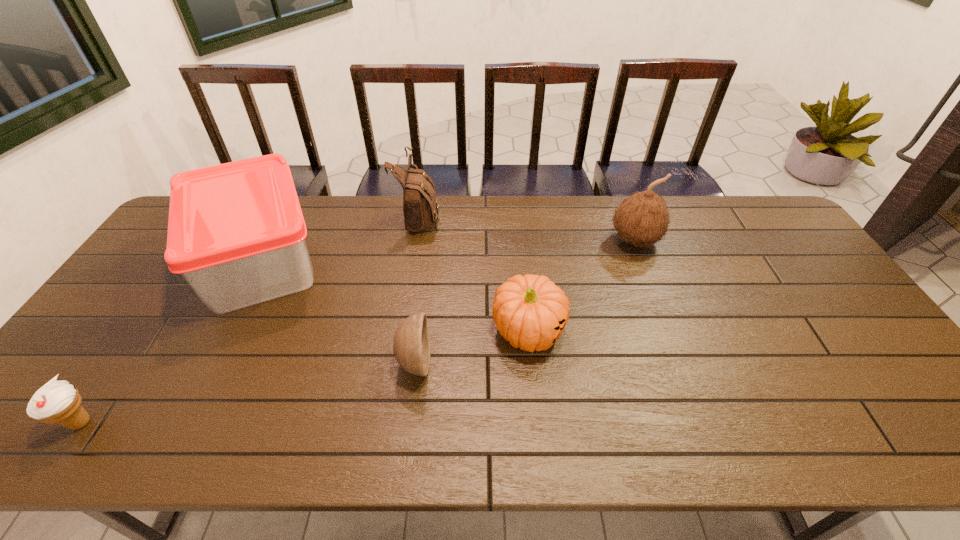
Find the location of `shoulder bag`. shoulder bag is located at coordinates (420, 207).

The width and height of the screenshot is (960, 540). What are the coordinates of `coconut` in the screenshot? It's located at click(642, 219).

Where is `tray`? The width and height of the screenshot is (960, 540). tray is located at coordinates (236, 232).

I want to click on pumpkin, so click(530, 311).

The width and height of the screenshot is (960, 540). I want to click on bowl, so click(411, 345).

Identify the location of the nearest object. (59, 402).

Image resolution: width=960 pixels, height=540 pixels. Identify the location of free space located 0.310m on the front-facing side of the shoulder bag. (530, 215).

Locate an element on the screen. free location located 0.320m on the surface of the coconut is located at coordinates (673, 342).

Where is `free location located 0.070m on the back of the tray`? free location located 0.070m on the back of the tray is located at coordinates (292, 200).

Locate an element on the screen. free region located on the surface of the fifth object from left to right is located at coordinates (538, 424).